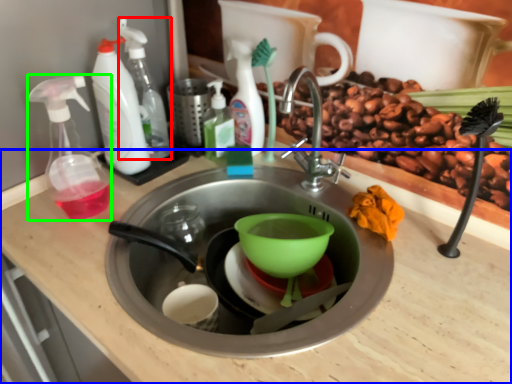
Question: Based on their relative distances, which object is farther from cleaning product (highlighted by a red box)? Choose from counter top (highlighted by a blue box) and soap dispenser (highlighted by a green box).

Choices:
 (A) counter top
 (B) soap dispenser

Answer: (A)